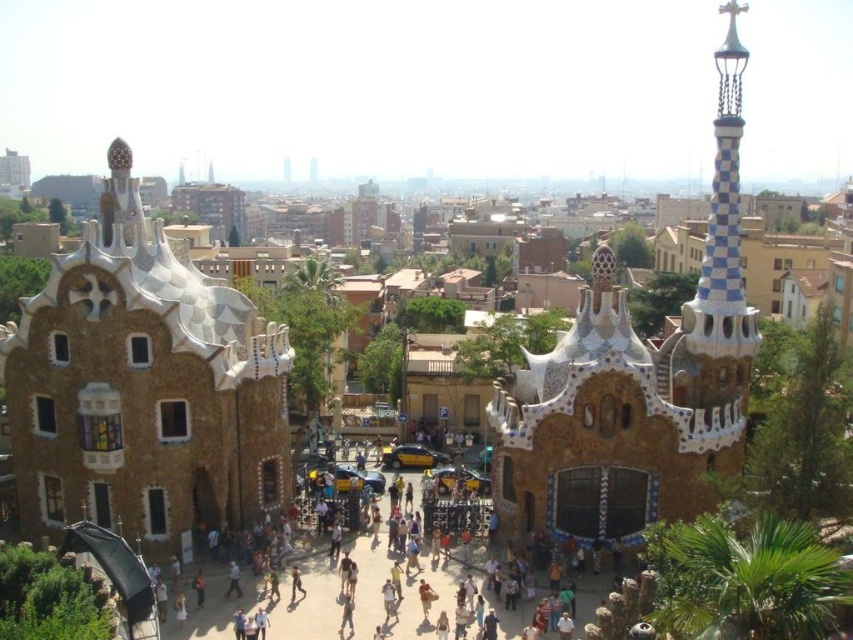
Between blue and white mosaic spire at upper right and brown textured stone archway at center, which one is positioned lower?

Positioned lower is brown textured stone archway at center.

Does point (723, 189) come closer to viewer compared to point (276, 625)?

No.

I want to click on blue and white mosaic spire at upper right, so click(x=720, y=259).

Which is in front, point (202, 401) or point (218, 620)?

Point (218, 620)

Does point (115, 205) come farther from viewer compared to point (213, 609)?

Yes.

Where is `white mosaic building at left`? Image resolution: width=853 pixels, height=640 pixels. white mosaic building at left is located at coordinates (143, 387).

Is white mosaic building at left below blue and white mosaic spire at upper right?

Indeed, white mosaic building at left is positioned under blue and white mosaic spire at upper right.

Can you confirm if white mosaic building at left is thinner than blue and white mosaic spire at upper right?

Incorrect, white mosaic building at left's width is not less than blue and white mosaic spire at upper right's.

Is point (161, 520) positioned behind point (724, 88)?

No, it is not.

Identify the location of white mosaic building at left. This screenshot has width=853, height=640. (143, 387).